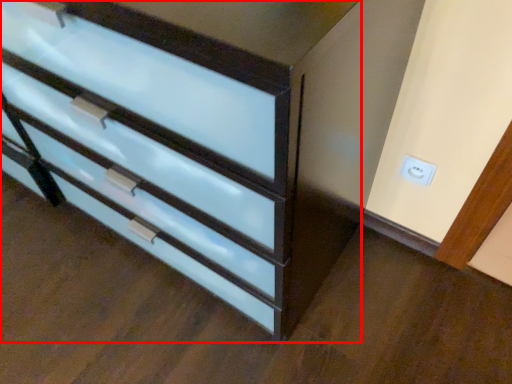
Question: From the image's perspective, where is chest of drawers (annotated by the red box) located relative to electric outlet?

Choices:
 (A) above
 (B) below

Answer: (A)